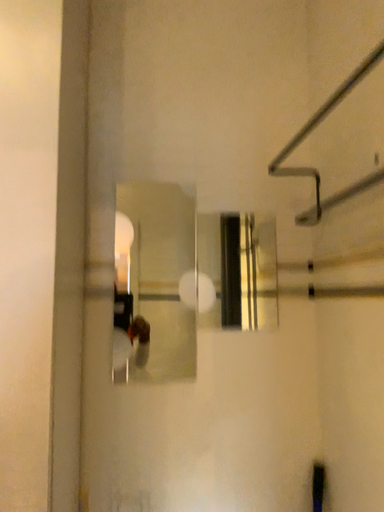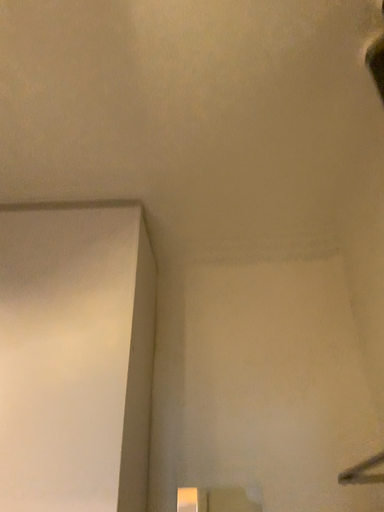
Question: How did the camera likely rotate when shooting the video?

Choices:
 (A) rotated upward
 (B) rotated downward

Answer: (A)